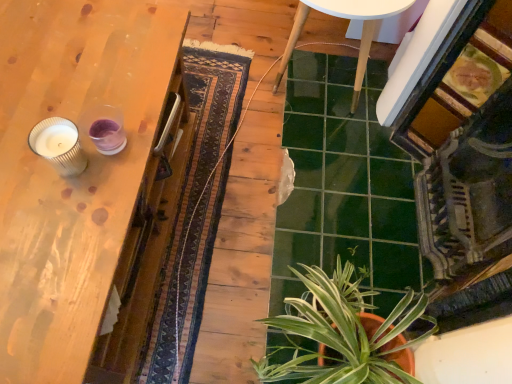
Identify the location of vacant region to the right of ridged glass candle at left. Image resolution: width=512 pixels, height=384 pixels. (120, 170).